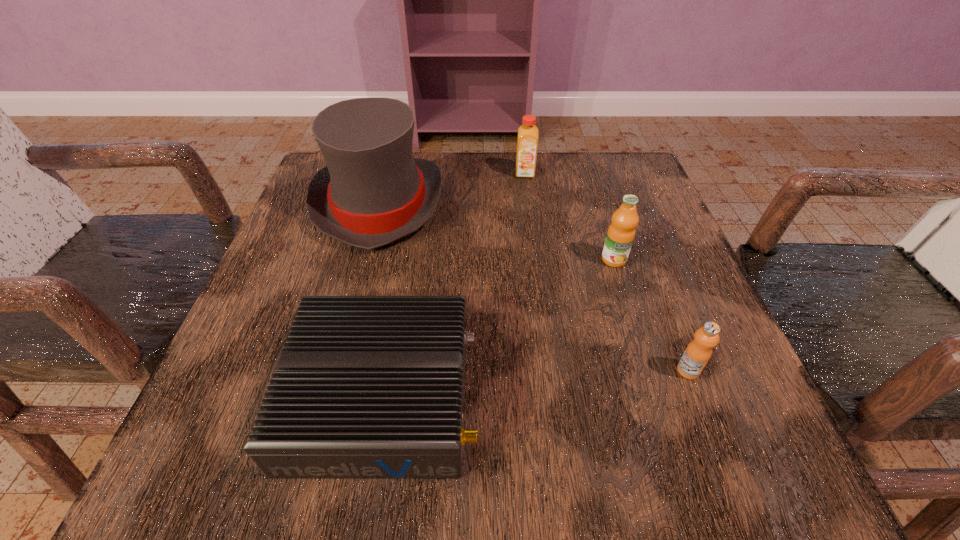
The width and height of the screenshot is (960, 540). I want to click on vacant space that satisfies the following two spatial constraints: 1. on the front and back of the leftmost orange juice; 2. on the back panel of the router, so click(555, 396).

This screenshot has width=960, height=540. Identify the location of free space that satisfies the following two spatial constraints: 1. on the label of the second nearest orange juice; 2. on the back panel of the shortest object. (657, 396).